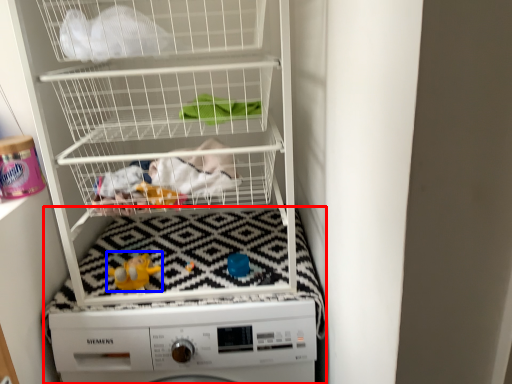
Question: Among these objects, which one is nearest to the camera, machine (highlighted by a red box) or toy (highlighted by a blue box)?

Choices:
 (A) machine
 (B) toy

Answer: (A)